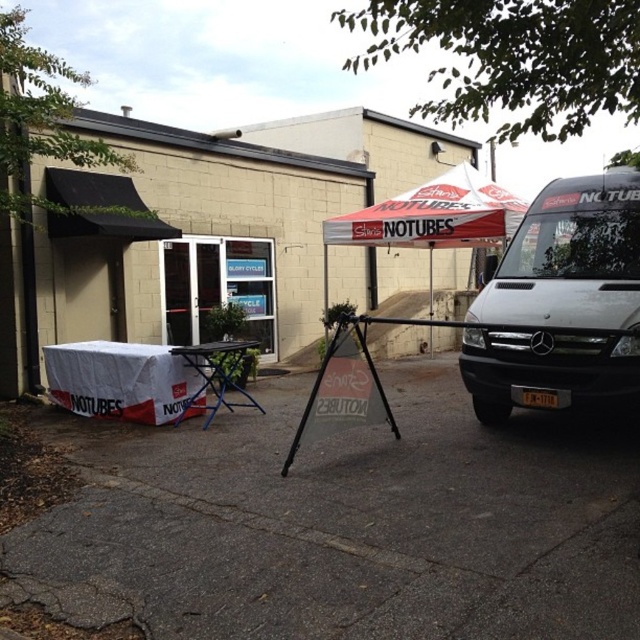
You are standing in front of the building and want to walk towards the NOTUBES table. Which point, point (496, 364) or point (426, 236), is closer to you as you approach the table?

Point (496, 364) is closer to the viewer than point (426, 236), so it is the closer point as you approach the table.